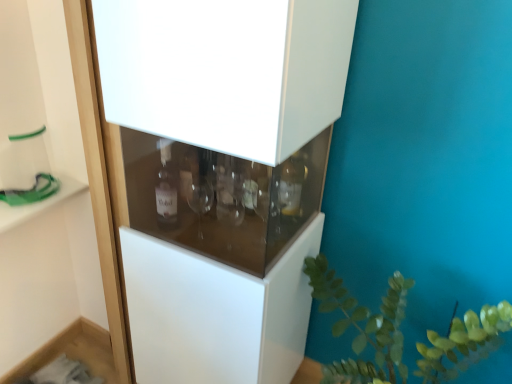
Describe the element at coordinates (362, 326) in the screenshot. I see `green leafy plant at lower right` at that location.

This screenshot has height=384, width=512. Find the location of `green leafy plant at lower right`. green leafy plant at lower right is located at coordinates (362, 326).

Measure the distance between point (397, 306) and camera.

The depth of point (397, 306) is 3.95 feet.

Where is `green leafy plant at lower right`? green leafy plant at lower right is located at coordinates (362, 326).